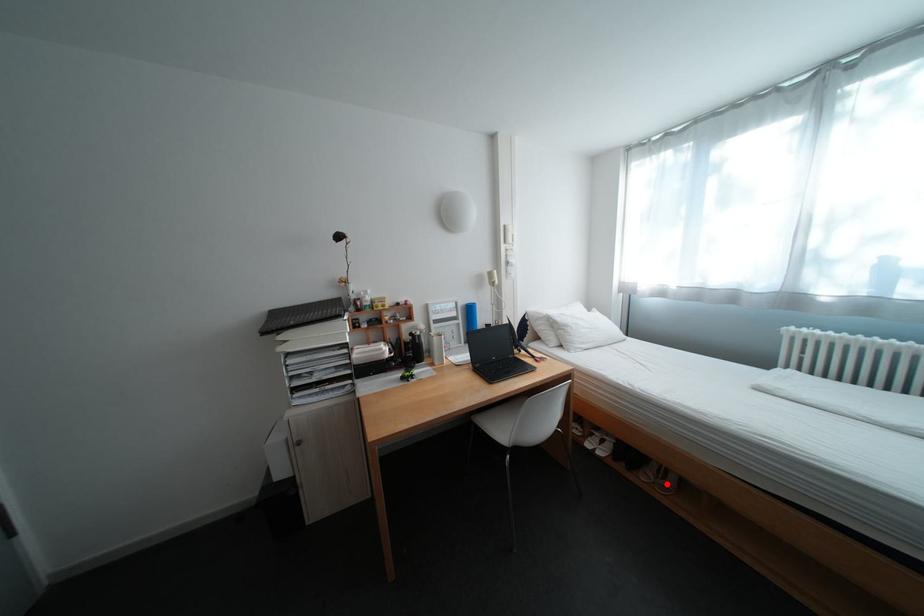
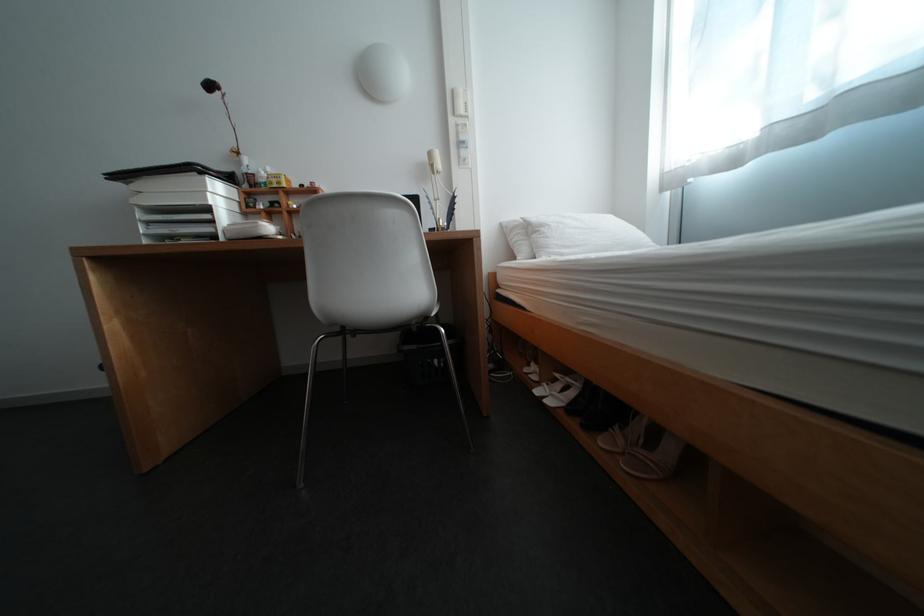
Locate, in the second image, the point that corresponds to the highlighted location in the first image.

(637, 455)